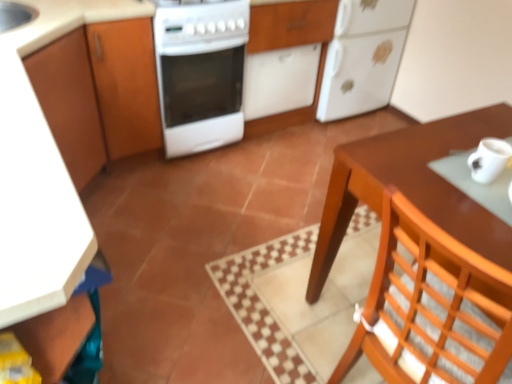
This screenshot has height=384, width=512. I want to click on vacant point to the left of white matte mug at right, so click(420, 170).